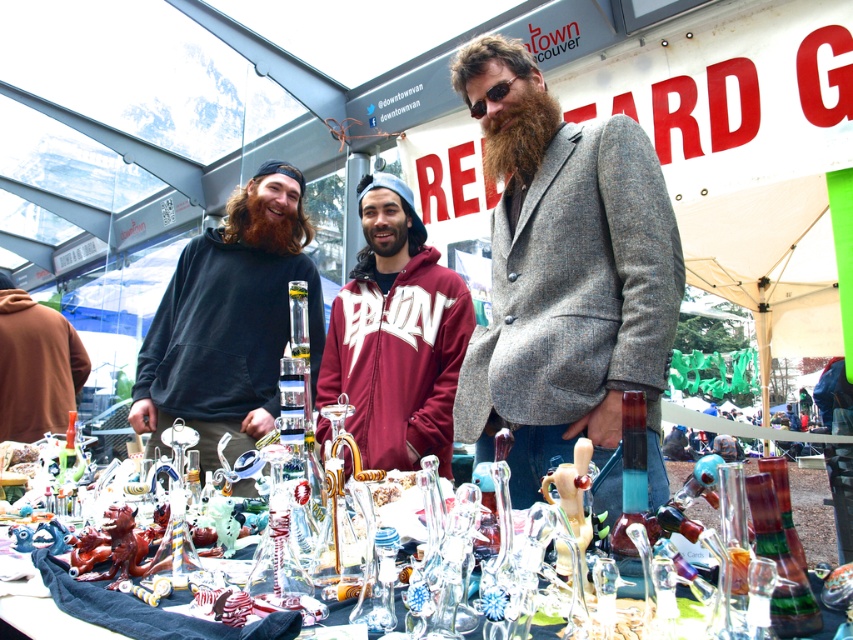
You are a customer at the market and want to purchase a garment that is wider. Which one should you choose between the gray wool blazer at center and the matte black hoodie at left?

The matte black hoodie at left is wider than the gray wool blazer at center, so you should choose the matte black hoodie at left.

You are a customer at the market and want to pick up both the matte black hoodie at left and the brown hoodie at left. The vendor requires you to grab both items simultaneously with your hands. If your arms can reach 36 inches, will you be able to grab both items at the same time?

The matte black hoodie at left and brown hoodie at left are 35.55 inches apart from each other. Since your arms can reach 36 inches, you can grab both items at the same time.